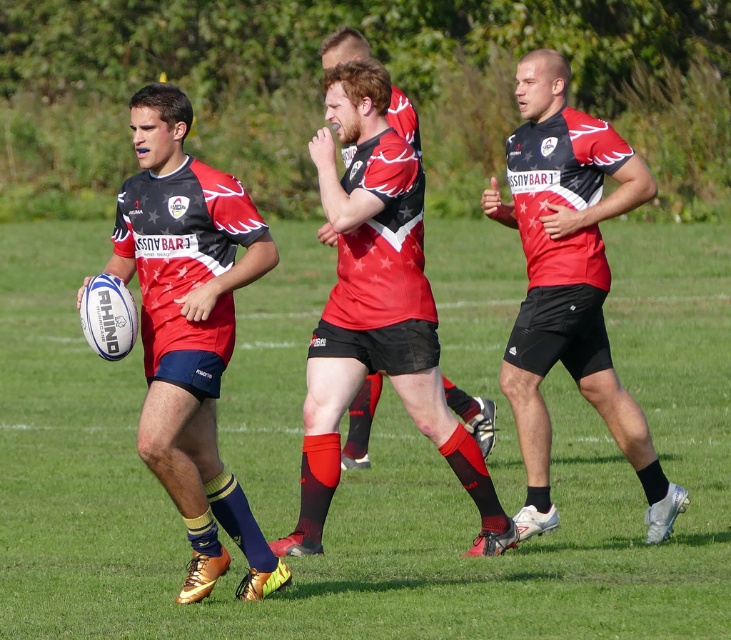
Question: Among these points, which one is farthest from the camera?

Choices:
 (A) (561, 156)
 (B) (224, 368)

Answer: (A)

Question: Estimate the real-world distances between objects in this image. Which object is closer to the matte red jersey at center?

Choices:
 (A) matte black shorts at center
 (B) matte black rugby ball at left

Answer: (A)

Question: Among these objects, which one is nearest to the camera?

Choices:
 (A) matte black shorts at center
 (B) matte red jersey at center
 (C) matte black rugby ball at left

Answer: (C)

Question: Is matte black shorts at center further to camera compared to matte red jersey at center?

Choices:
 (A) no
 (B) yes

Answer: (A)

Question: Is matte black rugby ball at left to the left of matte black shorts at center from the viewer's perspective?

Choices:
 (A) no
 (B) yes

Answer: (B)

Question: Can you confirm if matte black rugby ball at left is positioned below matte black shorts at center?

Choices:
 (A) yes
 (B) no

Answer: (A)